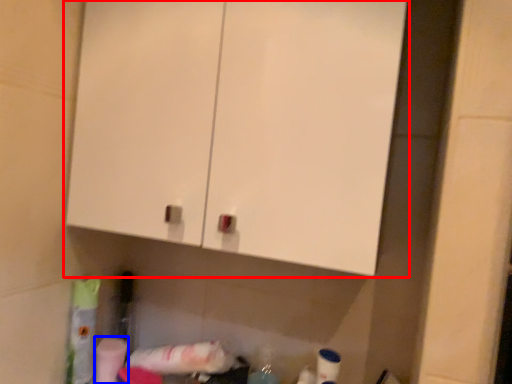
Question: Among these objects, which one is farthest to the camera, cabinetry (highlighted by a red box) or toilet paper (highlighted by a blue box)?

Choices:
 (A) cabinetry
 (B) toilet paper

Answer: (B)